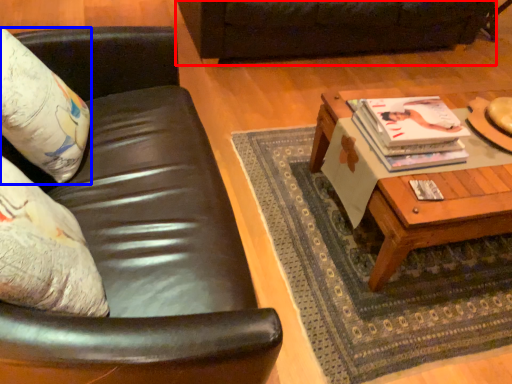
Question: Which object appears farthest to the camera in this image, studio couch (highlighted by a red box) or pillow (highlighted by a blue box)?

Choices:
 (A) studio couch
 (B) pillow

Answer: (A)